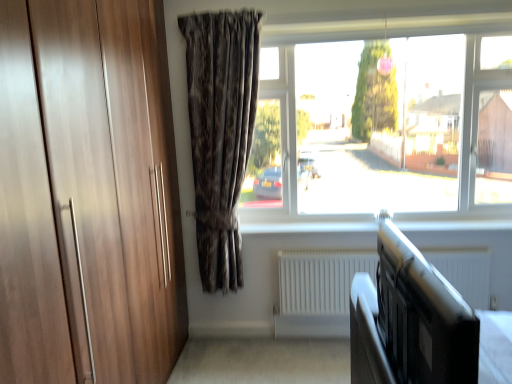
This screenshot has height=384, width=512. Identify the location of transparent glass window at center. (394, 124).

This screenshot has width=512, height=384. What do you see at coordinates (367, 336) in the screenshot?
I see `black matte bed frame at lower right` at bounding box center [367, 336].

This screenshot has height=384, width=512. Describe the element at coordinates (320, 280) in the screenshot. I see `white matte radiator at lower center` at that location.

This screenshot has width=512, height=384. Describe the element at coordinates (220, 133) in the screenshot. I see `dark brown textured curtain at center` at that location.

Image resolution: width=512 pixels, height=384 pixels. In order to click on transparent glass window at center in this screenshot , I will do `click(394, 124)`.

In the scene shown: Looking at the image, does dark brown textured curtain at center seem bigger or smaller compared to transparent glass window at center?

Considering their sizes, dark brown textured curtain at center takes up less space than transparent glass window at center.

Considering the relative positions of dark brown textured curtain at center and transparent glass window at center in the image provided, is dark brown textured curtain at center to the left of transparent glass window at center from the viewer's perspective?

Indeed, dark brown textured curtain at center is positioned on the left side of transparent glass window at center.

From a real-world perspective, which is physically below, dark brown textured curtain at center or transparent glass window at center?

dark brown textured curtain at center.

Can you tell me how much dark brown textured curtain at center and transparent glass window at center differ in facing direction?

They differ by 0.000698 degrees in their facing directions.

Consider the image. Is black matte bed frame at lower right located within white matte radiator at lower center?

No, black matte bed frame at lower right is not a part of white matte radiator at lower center.

Could you tell me if white matte radiator at lower center is turned towards black matte bed frame at lower right?

Yes, white matte radiator at lower center is aimed at black matte bed frame at lower right.

Are white matte radiator at lower center and black matte bed frame at lower right located far from each other?

Yes, white matte radiator at lower center and black matte bed frame at lower right are quite far apart.

Is white matte radiator at lower center wider or thinner than transparent glass window at center?

Considering their sizes, white matte radiator at lower center looks slimmer than transparent glass window at center.

From the picture: How different are the orientations of white matte radiator at lower center and transparent glass window at center in degrees?

The facing directions of white matte radiator at lower center and transparent glass window at center are 0.403 degrees apart.

From a real-world perspective, is white matte radiator at lower center located beneath transparent glass window at center?

→ Yes.

Is dark brown textured curtain at center further to the viewer compared to black matte bed frame at lower right?

Yes.

From a real-world perspective, is dark brown textured curtain at center under black matte bed frame at lower right?

No, from a real-world perspective, dark brown textured curtain at center is not beneath black matte bed frame at lower right.

Measure the distance from dark brown textured curtain at center to black matte bed frame at lower right.

dark brown textured curtain at center is 1.37 meters from black matte bed frame at lower right.

How many degrees apart are the facing directions of dark brown textured curtain at center and black matte bed frame at lower right?

There is a 89.6-degree angle between the facing directions of dark brown textured curtain at center and black matte bed frame at lower right.

Considering the relative positions of transparent glass window at center and white matte radiator at lower center in the image provided, is transparent glass window at center to the right of white matte radiator at lower center from the viewer's perspective?

No, transparent glass window at center is not to the right of white matte radiator at lower center.

Could you tell me if transparent glass window at center is facing white matte radiator at lower center?

No.

Does transparent glass window at center come in front of white matte radiator at lower center?

Yes.

The height and width of the screenshot is (384, 512). Find the location of `radiator located underneath the transparent glass window at center (from a real-world perspective)`. radiator located underneath the transparent glass window at center (from a real-world perspective) is located at coordinates (320, 280).

From a real-world perspective, is transparent glass window at center on top of black matte bed frame at lower right?

Yes, from a real-world perspective, transparent glass window at center is over black matte bed frame at lower right

From the image's perspective, is transparent glass window at center located beneath black matte bed frame at lower right?

Incorrect, from the image's perspective, transparent glass window at center is higher than black matte bed frame at lower right.

At what (x,y) coordinates should I click in order to perform the action: click on window that appears above the black matte bed frame at lower right (from a real-world perspective). Please return your answer as a coordinate pair (x, y). The image size is (512, 384). Looking at the image, I should click on (394, 124).

How many degrees apart are the facing directions of transparent glass window at center and black matte bed frame at lower right?

The angular difference between transparent glass window at center and black matte bed frame at lower right is 89.6 degrees.

How many degrees apart are the facing directions of white matte radiator at lower center and dark brown textured curtain at center?

The angle between the facing direction of white matte radiator at lower center and the facing direction of dark brown textured curtain at center is 0.403 degrees.

Consider the image. Between white matte radiator at lower center and dark brown textured curtain at center, which one has larger size?

Bigger between the two is dark brown textured curtain at center.

From the image's perspective, which object appears higher, white matte radiator at lower center or dark brown textured curtain at center?

dark brown textured curtain at center, from the image's perspective.

From a real-world perspective, does white matte radiator at lower center sit lower than dark brown textured curtain at center?

Yes, from a real-world perspective, white matte radiator at lower center is under dark brown textured curtain at center.

Locate an element on the screen. window that is behind the dark brown textured curtain at center is located at coordinates (394, 124).

In the image, there is a white matte radiator at lower center. Where is `bed frame above it (from the image's perspective)`? bed frame above it (from the image's perspective) is located at coordinates point(367,336).

From the picture: Based on their spatial positions, is transparent glass window at center or black matte bed frame at lower right further from white matte radiator at lower center?

black matte bed frame at lower right lies further to white matte radiator at lower center than the other object.

Consider the image. When comparing their distances from dark brown textured curtain at center, does transparent glass window at center or white matte radiator at lower center seem further?

Based on the image, white matte radiator at lower center appears to be further to dark brown textured curtain at center.

Based on their spatial positions, is black matte bed frame at lower right or transparent glass window at center closer to white matte radiator at lower center?

transparent glass window at center.

From the image, which object appears to be farther from transparent glass window at center, dark brown textured curtain at center or black matte bed frame at lower right?

black matte bed frame at lower right.

Based on their spatial positions, is dark brown textured curtain at center or black matte bed frame at lower right further from white matte radiator at lower center?

black matte bed frame at lower right lies further to white matte radiator at lower center than the other object.

Considering their positions, is white matte radiator at lower center positioned further to transparent glass window at center than black matte bed frame at lower right?

black matte bed frame at lower right is positioned further to the anchor transparent glass window at center.

Looking at the image, which one is located closer to dark brown textured curtain at center, white matte radiator at lower center or transparent glass window at center?

Among the two, transparent glass window at center is located nearer to dark brown textured curtain at center.

Considering their positions, is dark brown textured curtain at center positioned closer to black matte bed frame at lower right than white matte radiator at lower center?

white matte radiator at lower center is closer to black matte bed frame at lower right.

What are the coordinates of `curtain positioned between black matte bed frame at lower right and white matte radiator at lower center from near to far` in the screenshot? It's located at (220, 133).

The width and height of the screenshot is (512, 384). Find the location of `window located between black matte bed frame at lower right and white matte radiator at lower center in the depth direction`. window located between black matte bed frame at lower right and white matte radiator at lower center in the depth direction is located at coordinates (394, 124).

The height and width of the screenshot is (384, 512). Identify the location of curtain between transparent glass window at center and white matte radiator at lower center in the vertical direction. (220, 133).

Image resolution: width=512 pixels, height=384 pixels. Identify the location of curtain located between black matte bed frame at lower right and transparent glass window at center in the depth direction. (220, 133).